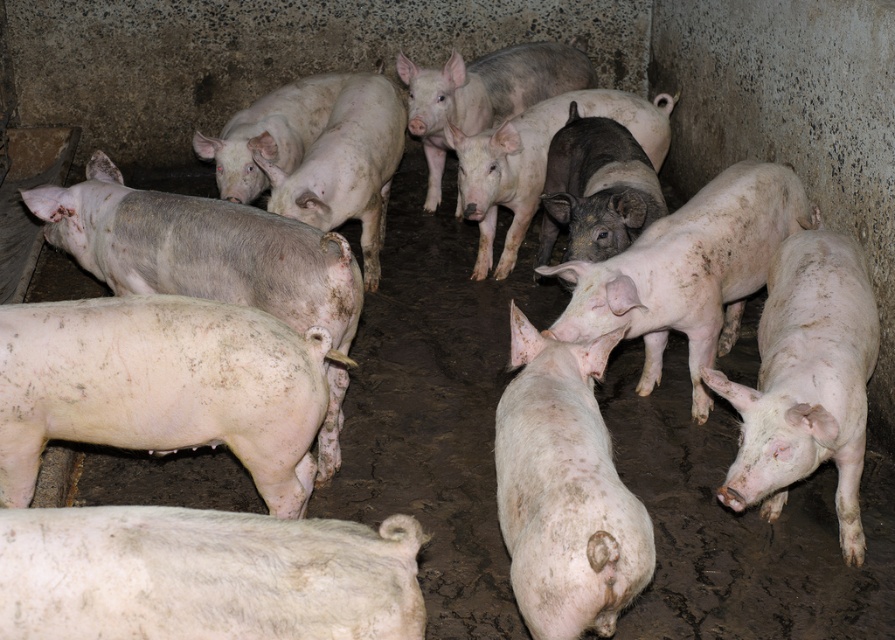
Consider the image. Between white matte pig at right and dirty white pig at center, which one has less height?

With less height is dirty white pig at center.

Who is taller, white matte pig at right or dirty white pig at center?

Standing taller between the two is white matte pig at right.

Identify the location of white matte pig at right. (806, 381).

Where is `white matte pig at right`? white matte pig at right is located at coordinates (806, 381).

Does point (371, 634) come farther from viewer compared to point (645, 340)?

That is False.

Measure the distance between white matte pig at lower left and camera.

5.24 feet

The image size is (895, 640). I want to click on white matte pig at lower left, so click(203, 573).

Is white matte pig at lower left below white matte pig at right?

Yes.

Who is positioned more to the right, white matte pig at lower left or white matte pig at right?

white matte pig at right is more to the right.

Who is more forward, (75, 618) or (842, 508)?

Point (75, 618) is more forward.

At what (x,y) coordinates should I click in order to perform the action: click on white matte pig at lower left. Please return your answer as a coordinate pair (x, y). Looking at the image, I should click on (203, 573).